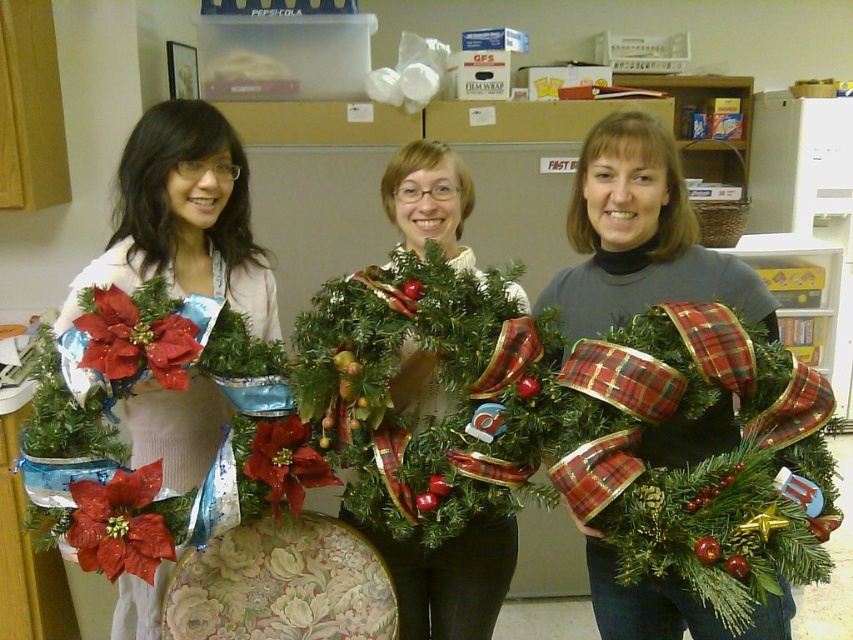
Looking at this image, does matte white sweater at center have a greater height compared to matte red poinsettia at lower left?

Correct, matte white sweater at center is much taller as matte red poinsettia at lower left.

In the scene shown: Which is above, matte white sweater at center or matte red poinsettia at lower left?

matte white sweater at center is above.

Between point (158, 196) and point (163, 525), which one is positioned in front?

Point (163, 525) is more forward.

Find the location of a particular element. Image resolution: width=853 pixels, height=640 pixels. matte white sweater at center is located at coordinates click(x=184, y=216).

Does shiny red ribbon at center have a greater width compared to matte red poinsettia at lower left?

Yes.

Is point (181, 330) less distant than point (138, 480)?

That is False.

Does point (177, 356) come closer to viewer compared to point (73, 515)?

That is True.

Where is `shiny red ribbon at center`? The width and height of the screenshot is (853, 640). shiny red ribbon at center is located at coordinates (474, 422).

Is green matte wreath at center smaller than matte red poinsettia at lower left?

Incorrect, green matte wreath at center is not smaller in size than matte red poinsettia at lower left.

The height and width of the screenshot is (640, 853). What do you see at coordinates (641, 237) in the screenshot?
I see `green matte wreath at center` at bounding box center [641, 237].

This screenshot has width=853, height=640. What are the coordinates of `green matte wreath at center` in the screenshot? It's located at (641, 237).